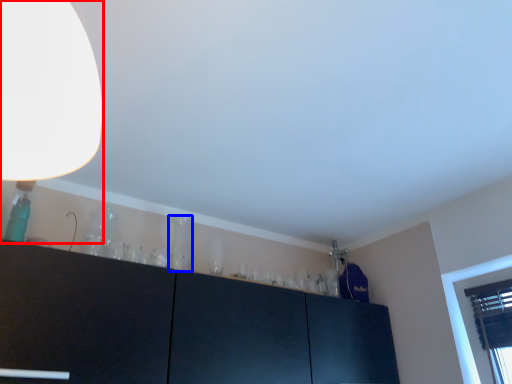
Question: Among these objects, which one is nearest to the camera, lamp (highlighted by a red box) or glass vase (highlighted by a blue box)?

Choices:
 (A) lamp
 (B) glass vase

Answer: (A)